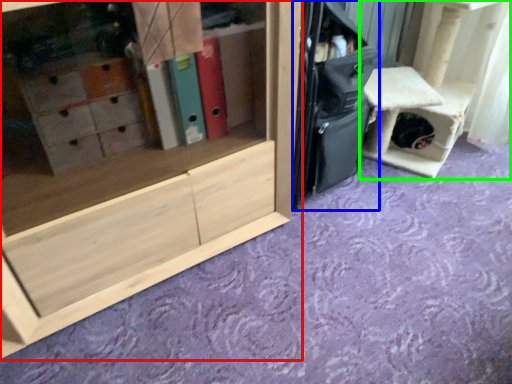
Question: Based on their relative distances, which object is nearer to cabinetry (highlighted by a red box)? Choose from luggage (highlighted by a blue box) and furniture (highlighted by a green box).

Choices:
 (A) luggage
 (B) furniture

Answer: (A)